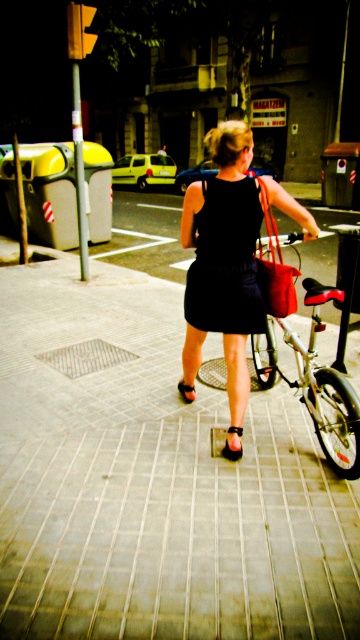
Is matte black dress at center wider than brown leather sandal at center?

Yes, matte black dress at center is wider than brown leather sandal at center.

Does matte black dress at center have a larger size compared to brown leather sandal at center?

Correct, matte black dress at center is larger in size than brown leather sandal at center.

Which is behind, point (230, 298) or point (231, 428)?

Point (231, 428)

Image resolution: width=360 pixels, height=640 pixels. In order to click on matte black dress at center in this screenshot , I will do `click(223, 260)`.

Which is more to the left, brown leather sandal at center or black leather sandal at center?

black leather sandal at center

Based on the photo, can you confirm if brown leather sandal at center is taller than black leather sandal at center?

Yes.

Between point (235, 456) and point (178, 381), which one is positioned in front?

Point (235, 456) is more forward.

Identify the location of brown leather sandal at center. (231, 451).

Between gray tile pavement at center and black leather sandal at center, which one appears on the left side from the viewer's perspective?

gray tile pavement at center

Can you confirm if gray tile pavement at center is positioned above black leather sandal at center?

Actually, gray tile pavement at center is below black leather sandal at center.

Between point (196, 410) and point (182, 380), which one is positioned in front?

Point (196, 410) is in front.

Find the location of a particular element. The image size is (360, 640). gray tile pavement at center is located at coordinates (155, 481).